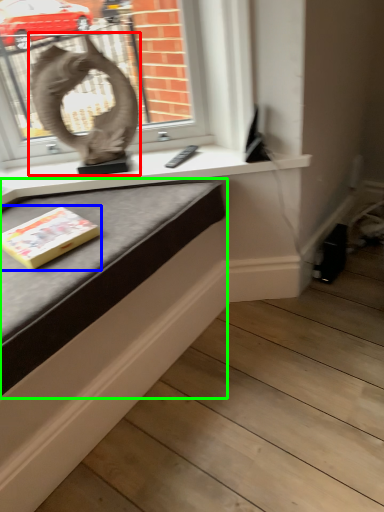
Question: Estimate the real-world distances between objects in this image. Which object is farther from sculpture (highlighted by a red box), paperback book (highlighted by a blue box) or table (highlighted by a green box)?

Choices:
 (A) paperback book
 (B) table

Answer: (A)